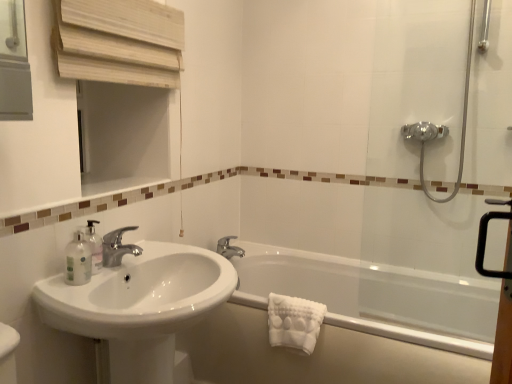
This screenshot has height=384, width=512. Find the location of `free space behind silver metallic faucet at upper center, which appears as the 2th tap when viewed from the left`. free space behind silver metallic faucet at upper center, which appears as the 2th tap when viewed from the left is located at coordinates (233, 245).